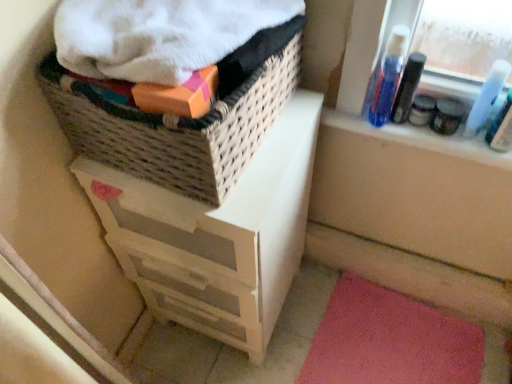
Question: Considering the relative sizes of white painted wood chest of drawers at upper left and blue plastic bottle at upper right, the 1th mouthwash in the left-to-right sequence, in the image provided, is white painted wood chest of drawers at upper left thinner than blue plastic bottle at upper right, the 1th mouthwash in the left-to-right sequence,?

Choices:
 (A) no
 (B) yes

Answer: (A)

Question: Is white painted wood chest of drawers at upper left shorter than blue plastic bottle at upper right, the 1th mouthwash in the left-to-right sequence?

Choices:
 (A) yes
 (B) no

Answer: (B)

Question: From a real-world perspective, is white painted wood chest of drawers at upper left beneath blue plastic bottle at upper right, acting as the 3th mouthwash starting from the right?

Choices:
 (A) yes
 (B) no

Answer: (A)

Question: Could you tell me if white painted wood chest of drawers at upper left is turned towards blue plastic bottle at upper right, acting as the 3th mouthwash starting from the right?

Choices:
 (A) no
 (B) yes

Answer: (A)

Question: Can you confirm if white painted wood chest of drawers at upper left is positioned to the right of blue plastic bottle at upper right, acting as the 3th mouthwash starting from the right?

Choices:
 (A) yes
 (B) no

Answer: (B)

Question: Would you say translucent plastic mouthwash at upper right, the 3th mouthwash viewed from the left, is inside or outside matte black jar at upper right, the 1th toiletry positioned from the left?

Choices:
 (A) outside
 (B) inside

Answer: (A)

Question: Based on their sizes in the image, would you say translucent plastic mouthwash at upper right, acting as the first mouthwash starting from the right, is bigger or smaller than matte black jar at upper right, the 1th toiletry positioned from the left?

Choices:
 (A) small
 (B) big

Answer: (B)

Question: Considering their positions, is translucent plastic mouthwash at upper right, the 3th mouthwash viewed from the left, located in front of or behind matte black jar at upper right, the 1th toiletry positioned from the left?

Choices:
 (A) behind
 (B) front

Answer: (B)

Question: Considering the positions of translucent plastic mouthwash at upper right, the 3th mouthwash viewed from the left, and matte black jar at upper right, the 1th toiletry positioned from the left, in the image, is translucent plastic mouthwash at upper right, the 3th mouthwash viewed from the left, taller or shorter than matte black jar at upper right, the 1th toiletry positioned from the left,?

Choices:
 (A) tall
 (B) short

Answer: (A)

Question: Is point (292, 96) closer or farther from the camera than point (420, 360)?

Choices:
 (A) closer
 (B) farther

Answer: (A)

Question: Is white painted wood chest of drawers at upper left wider or thinner than pink carpet at lower right?

Choices:
 (A) wide
 (B) thin

Answer: (B)

Question: In the image, is white painted wood chest of drawers at upper left positioned in front of or behind pink carpet at lower right?

Choices:
 (A) front
 (B) behind

Answer: (A)

Question: In the image, is white painted wood chest of drawers at upper left on the left side or the right side of pink carpet at lower right?

Choices:
 (A) left
 (B) right

Answer: (A)

Question: From the image's perspective, is white painted wood chest of drawers at upper left above or below blue plastic bottle at upper right, the 2th mouthwash viewed from the right?

Choices:
 (A) above
 (B) below

Answer: (B)

Question: From a real-world perspective, is white painted wood chest of drawers at upper left above or below blue plastic bottle at upper right, the second mouthwash from the left?

Choices:
 (A) below
 (B) above

Answer: (A)